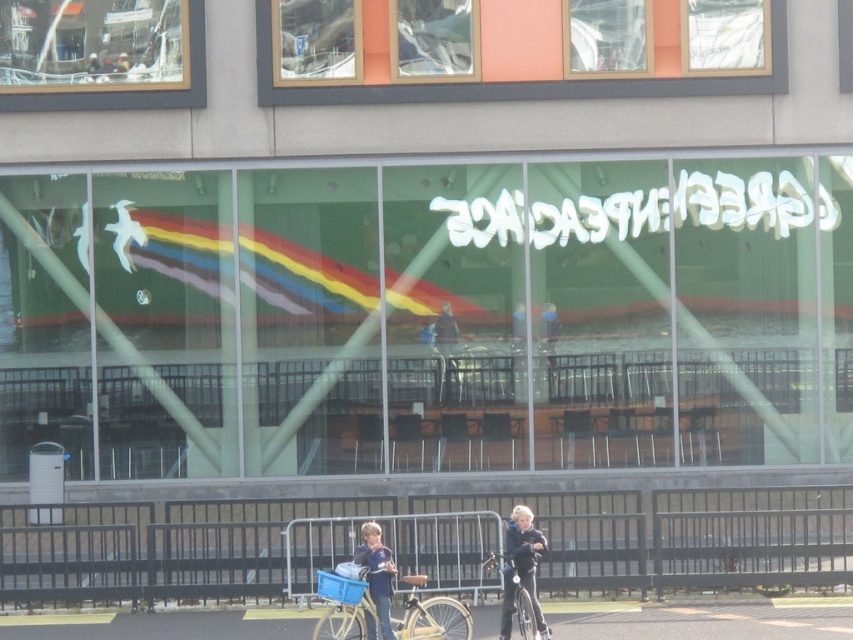
You are a delivery person standing in front of the building and need to place a large box that is 2 meters wide. The box must be placed between the green glass shop window at center and the blue denim jeans at lower center. Can the space between them accommodate the box?

The green glass shop window at center is wider than the blue denim jeans at lower center. However, the description only states their widths relative to each other but does not provide specific measurements. Without knowing the exact width of the space between them, it is impossible to determine if the 2m wide box will fit.